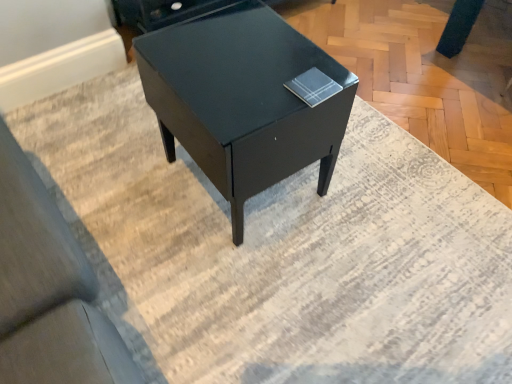
Locate an element on the screen. The width and height of the screenshot is (512, 384). empty space that is ontop of matte black table at center (from a real-world perspective) is located at coordinates (240, 64).